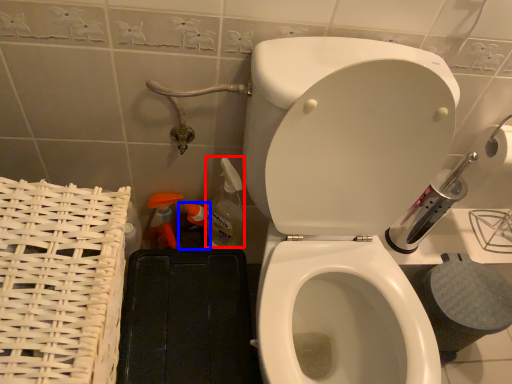
Question: Which point is closer to the camera, cleaning product (highlighted by a red box) or cleaning product (highlighted by a blue box)?

Choices:
 (A) cleaning product
 (B) cleaning product

Answer: (A)